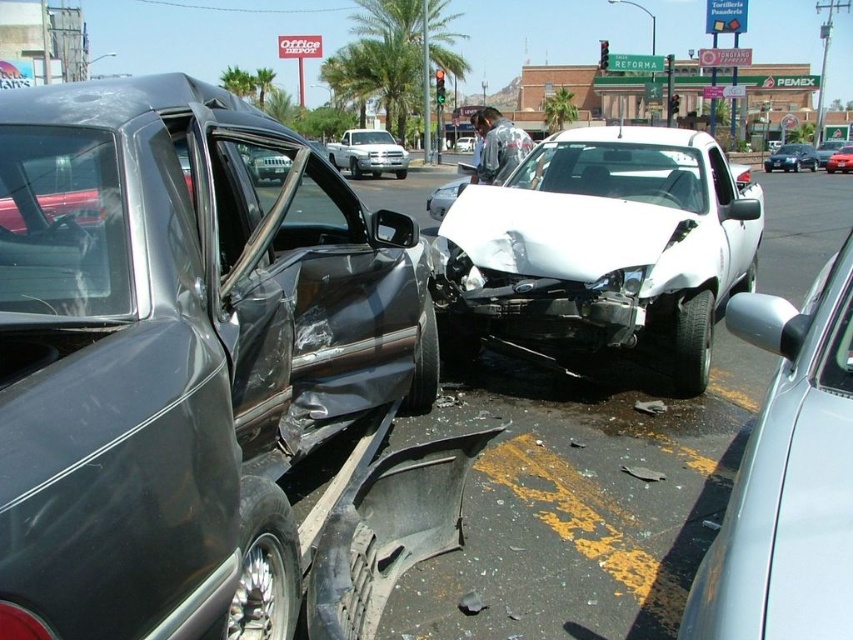
Question: Is satin silver car at right to the right of silver metallic pickup truck at center from the viewer's perspective?

Choices:
 (A) no
 (B) yes

Answer: (B)

Question: Does satin silver car at right appear over metallic silver sedan at center?

Choices:
 (A) no
 (B) yes

Answer: (A)

Question: Based on their relative distances, which object is nearer to the satin silver car at right?

Choices:
 (A) silver metallic pickup truck at center
 (B) matte black car at left

Answer: (B)

Question: Which is farther from the silver metallic pickup truck at center?

Choices:
 (A) satin silver car at right
 (B) metallic red sedan at center

Answer: (A)

Question: Which point is farther from the camera taking this photo?

Choices:
 (A) (775, 166)
 (B) (837, 157)

Answer: (A)

Question: Can you confirm if satin silver car at right is positioned to the left of silver metallic pickup truck at center?

Choices:
 (A) yes
 (B) no

Answer: (B)